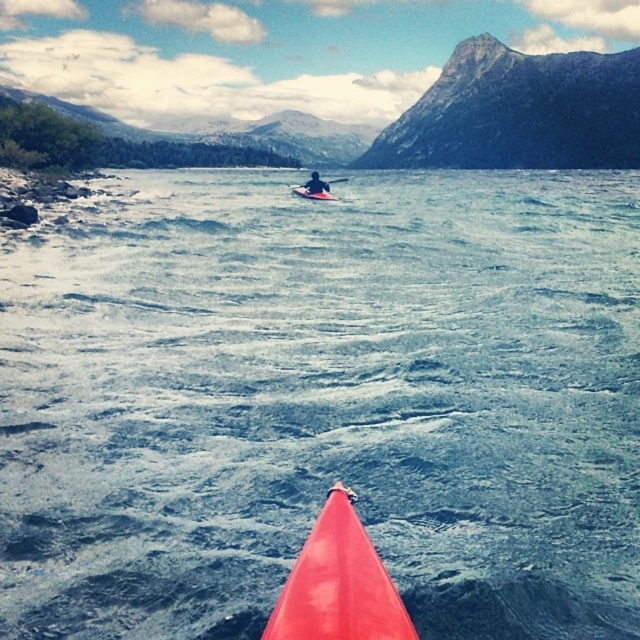
Is blue water at center positioned behind orange plastic canoe at center?

No, it is in front of orange plastic canoe at center.

Image resolution: width=640 pixels, height=640 pixels. What are the coordinates of `blue water at center` in the screenshot? It's located at (324, 403).

Locate an element on the screen. The height and width of the screenshot is (640, 640). blue water at center is located at coordinates (324, 403).

Does rugged granite mountain at upper right appear on the right side of matte red kayak at center?

Yes, rugged granite mountain at upper right is to the right of matte red kayak at center.

This screenshot has height=640, width=640. What are the coordinates of `rugged granite mountain at upper right` in the screenshot? It's located at (518, 113).

Is blue water at center positioned before rugged granite mountain at upper right?

Yes, blue water at center is in front of rugged granite mountain at upper right.

Is blue water at center to the left of rugged granite mountain at upper right from the viewer's perspective?

Correct, you'll find blue water at center to the left of rugged granite mountain at upper right.

Is point (38, 564) closer to camera compared to point (419, 102)?

That is True.

The image size is (640, 640). I want to click on blue water at center, so click(x=324, y=403).